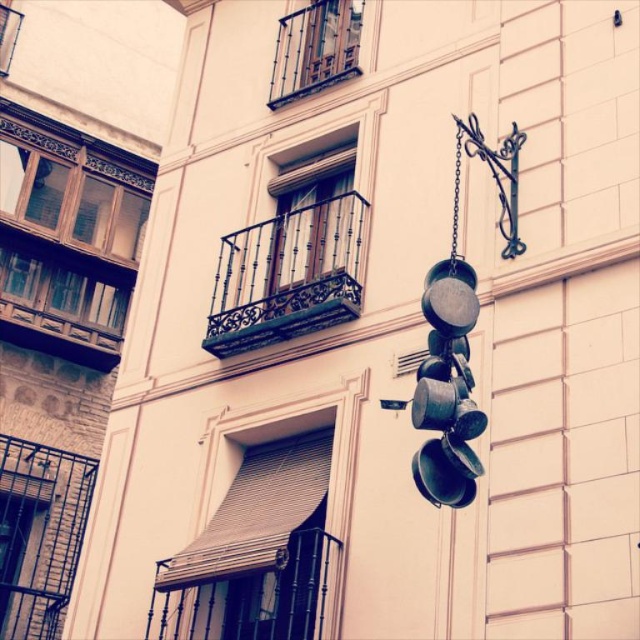
Is point (337, 248) farther from viewer compared to point (456, 470)?

Yes, it is.

Who is more distant from viewer, (328, 250) or (429, 296)?

Point (328, 250)

The height and width of the screenshot is (640, 640). In order to click on dark brown wrought iron balcony at center in this screenshot , I will do `click(288, 275)`.

Between dark brown wrought iron balcony at center and polished metal balcony at upper center, which one has less height?

dark brown wrought iron balcony at center is shorter.

Which is more to the right, dark brown wrought iron balcony at center or polished metal balcony at upper center?

polished metal balcony at upper center

Identify the location of dark brown wrought iron balcony at center. (288, 275).

Find the location of `dark brown wrought iron balcony at center`. dark brown wrought iron balcony at center is located at coordinates (288, 275).

Is green matte pans at right thinner than polished metal balcony at upper center?

No, green matte pans at right is not thinner than polished metal balcony at upper center.

Which is in front, point (472, 461) or point (316, 90)?

Positioned in front is point (472, 461).

Between point (440, 416) and point (291, 99), which one is positioned in front?

Point (440, 416) is in front.

Locate an element on the screen. The image size is (640, 640). green matte pans at right is located at coordinates (448, 388).